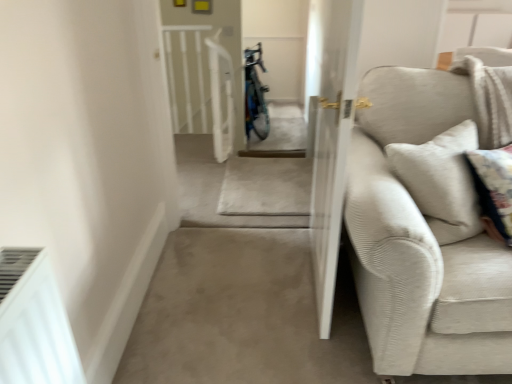
Question: Based on their sizes in the image, would you say beige corduroy couch at right is bigger or smaller than white textured screen door at center?

Choices:
 (A) big
 (B) small

Answer: (A)

Question: From the image's perspective, is beige corduroy couch at right located above or below white textured screen door at center?

Choices:
 (A) above
 (B) below

Answer: (B)

Question: Is beige corduroy couch at right taller or shorter than white textured screen door at center?

Choices:
 (A) tall
 (B) short

Answer: (B)

Question: From their relative heights in the image, would you say white textured screen door at center is taller or shorter than beige corduroy couch at right?

Choices:
 (A) short
 (B) tall

Answer: (B)

Question: Looking at the image, does white textured screen door at center seem bigger or smaller compared to beige corduroy couch at right?

Choices:
 (A) big
 (B) small

Answer: (B)

Question: From a real-world perspective, is white textured screen door at center physically located above or below beige corduroy couch at right?

Choices:
 (A) below
 (B) above

Answer: (B)

Question: Is white textured screen door at center in front of or behind beige corduroy couch at right in the image?

Choices:
 (A) behind
 (B) front

Answer: (A)